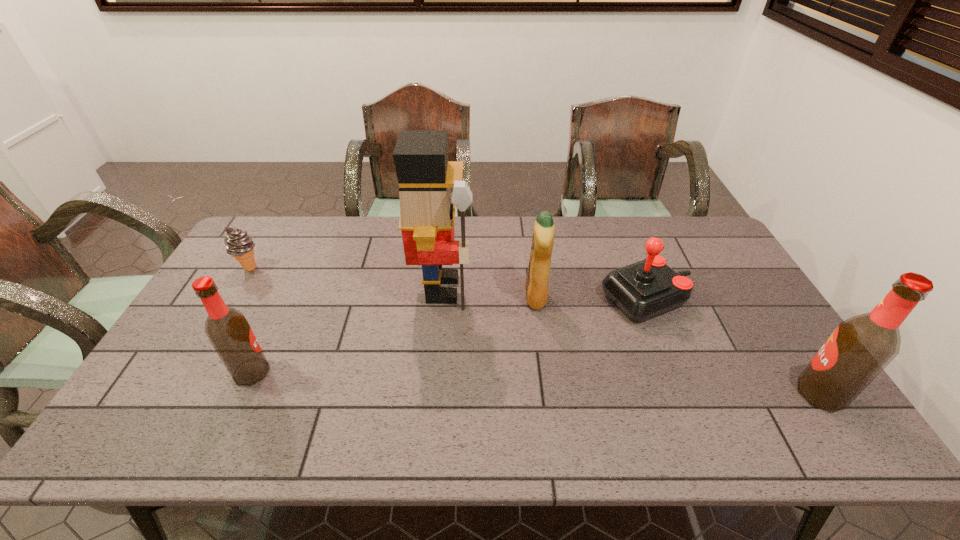
To ensure equal spacing by inserting another beer_bottle among them, please point out a vacant spot for this new beer_bottle. Please provide its 2D coordinates. Your answer should be formatted as a tuple, i.e. [(x, y)], where the tuple contains the x and y coordinates of a point satisfying the conditions above.

[(530, 383)]